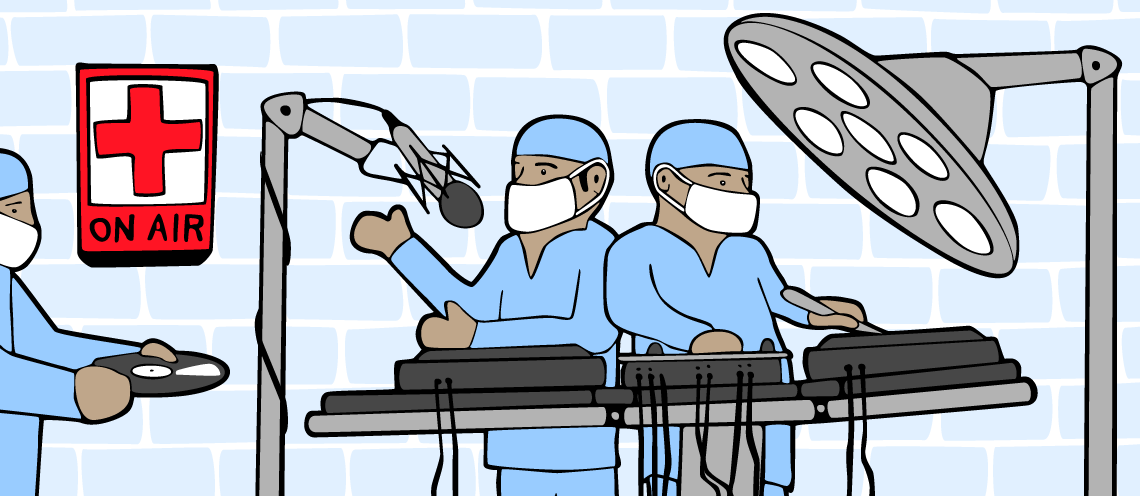
Find the location of a particular element. This screenshot has width=1140, height=496. light is located at coordinates (927, 161).